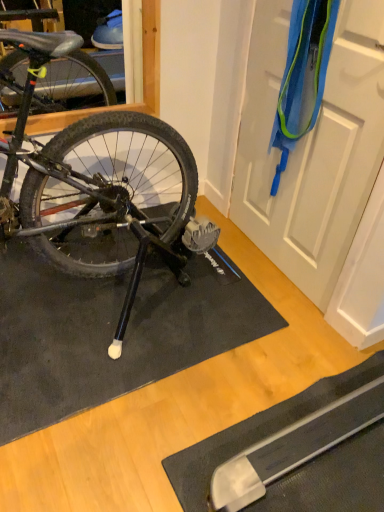
This screenshot has height=512, width=384. What are the coordinates of `white matte door at upper right` in the screenshot? It's located at (312, 148).

In order to face white matte door at upper right, should I rotate leftwards or rightwards?

Turn right by 13.757 degrees to look at white matte door at upper right.

Image resolution: width=384 pixels, height=512 pixels. What do you see at coordinates (312, 148) in the screenshot?
I see `white matte door at upper right` at bounding box center [312, 148].

The width and height of the screenshot is (384, 512). Find the location of `black rubber doormat at lower left`. black rubber doormat at lower left is located at coordinates (112, 332).

The height and width of the screenshot is (512, 384). What do you see at coordinates (112, 332) in the screenshot?
I see `black rubber doormat at lower left` at bounding box center [112, 332].

The image size is (384, 512). In order to click on white matte door at upper right in this screenshot , I will do `click(312, 148)`.

Which object is positioned more to the right, white matte door at upper right or black rubber doormat at lower left?

Positioned to the right is white matte door at upper right.

Between white matte door at upper right and black rubber doormat at lower left, which one is positioned in front?

white matte door at upper right is closer to the camera.

Does point (318, 262) lie behind point (126, 378)?

Yes.

From the image's perspective, is white matte door at upper right located beneath black rubber doormat at lower left?

No, from the image's perspective, white matte door at upper right is not below black rubber doormat at lower left.

From a real-world perspective, which is physically below, white matte door at upper right or black rubber doormat at lower left?

In real-world perspective, black rubber doormat at lower left is lower.

Which object is thinner, white matte door at upper right or black rubber doormat at lower left?

With smaller width is white matte door at upper right.

Which of these two, white matte door at upper right or black rubber doormat at lower left, stands taller?

white matte door at upper right.

Considering the sizes of objects white matte door at upper right and black rubber doormat at lower left in the image provided, who is bigger, white matte door at upper right or black rubber doormat at lower left?

Bigger between the two is black rubber doormat at lower left.

Is white matte door at upper right outside of black rubber doormat at lower left?

Indeed, white matte door at upper right is completely outside black rubber doormat at lower left.

From the picture: Are white matte door at upper right and black rubber doormat at lower left located far from each other?

That's not correct — white matte door at upper right is a little close to black rubber doormat at lower left.

Could you tell me if white matte door at upper right is facing black rubber doormat at lower left?

Yes, white matte door at upper right is turned towards black rubber doormat at lower left.

Based on the photo, what's the angular difference between white matte door at upper right and black rubber doormat at lower left's facing directions?

They differ by 89.9 degrees in their facing directions.

Identify the location of door on the right of black rubber doormat at lower left. The image size is (384, 512). (312, 148).

Is black rubber doormat at lower left at the right side of white matte door at upper right?

No.

Is black rubber doormat at lower left positioned before white matte door at upper right?

No, the depth of black rubber doormat at lower left is greater than that of white matte door at upper right.

Which is closer, (180,331) or (259,135)?

Point (180,331) is closer to the camera than point (259,135).

From the image's perspective, is black rubber doormat at lower left located above or below white matte door at upper right?

From the image's perspective, black rubber doormat at lower left appears below white matte door at upper right.

From a real-world perspective, which object stands above the other?

In real-world perspective, white matte door at upper right is above.

Between black rubber doormat at lower left and white matte door at upper right, which one has smaller width?

white matte door at upper right is thinner.

From their relative heights in the image, would you say black rubber doormat at lower left is taller or shorter than white matte door at upper right?

Considering their sizes, black rubber doormat at lower left has less height than white matte door at upper right.

Which of these two, black rubber doormat at lower left or white matte door at upper right, is smaller?

white matte door at upper right.

Is black rubber doormat at lower left inside the boundaries of white matte door at upper right, or outside?

black rubber doormat at lower left is not enclosed by white matte door at upper right.

Is black rubber doormat at lower left beside white matte door at upper right?

There is a gap between black rubber doormat at lower left and white matte door at upper right.

Could you tell me if black rubber doormat at lower left is turned towards white matte door at upper right?

No.

What's the angular difference between black rubber doormat at lower left and white matte door at upper right's facing directions?

black rubber doormat at lower left and white matte door at upper right are facing 89.9 degrees away from each other.

You are a GUI agent. You are given a task and a screenshot of the screen. Output one action in this format:
    pyautogui.click(x=<x>, y=<y>)
    Task: Click on the doormat lying below the white matte door at upper right (from the image's perspective)
    
    Given the screenshot: What is the action you would take?
    pyautogui.click(x=112, y=332)

Identify the location of doormat below the white matte door at upper right (from the image's perspective). This screenshot has width=384, height=512. (112, 332).

This screenshot has width=384, height=512. I want to click on doormat on the left of white matte door at upper right, so click(x=112, y=332).